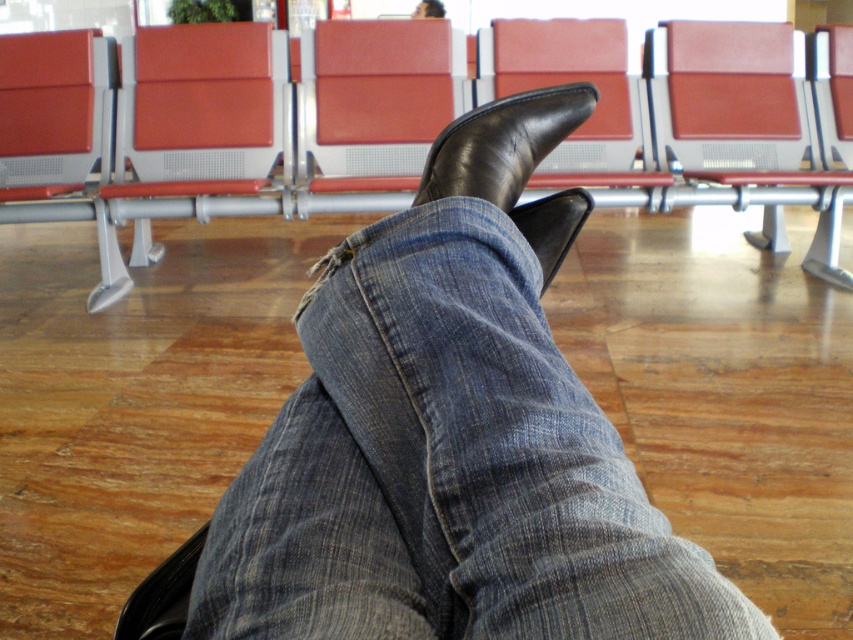
You are designing a new seating area and need to ensure that the shiny black boot at center can fit comfortably next to the matte leather chair at center. Based on the scene, which object is wider?

The matte leather chair at center is wider than the shiny black boot at center, so the boot can fit comfortably next to it.

You are a cleaning staff member in a waiting area. You need to clean the denim at center and the matte red chair at center. Which object should you clean first if you start from the floor and move upward?

The denim at center is located below the matte red chair at center, so you should clean the denim at center first before moving to the matte red chair at center.